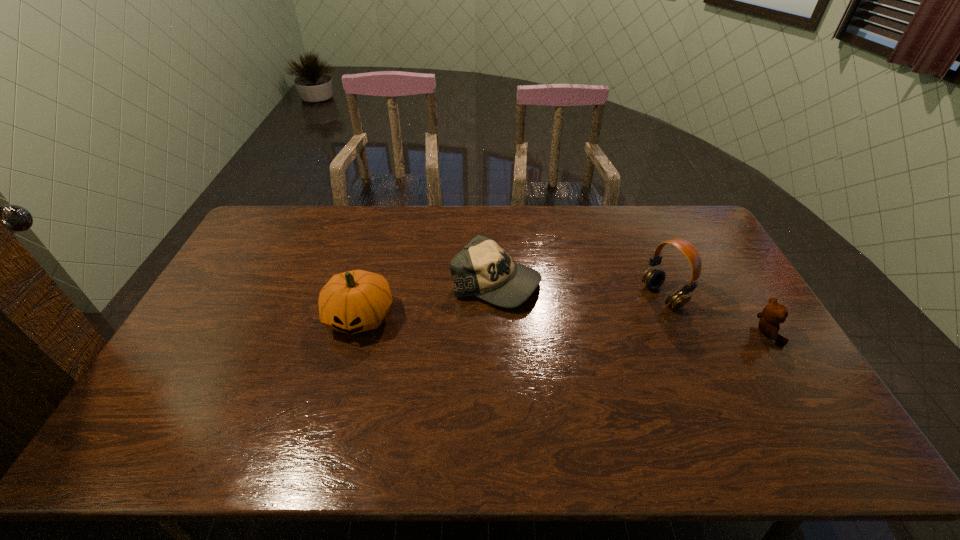
At what (x,y) coordinates should I click in order to perform the action: click on free space that satisfies the following two spatial constraints: 1. on the front side of the headset; 2. on the left side of the second object from left to right. Please return your answer as a coordinate pair (x, y). The image size is (960, 540). Looking at the image, I should click on coord(497,296).

This screenshot has width=960, height=540. In order to click on vacant area in the image that satisfies the following two spatial constraints: 1. on the side of the gourd with the carved face; 2. on the front-facing side of the rightmost object in this screenshot , I will do `click(355, 333)`.

The image size is (960, 540). Find the location of `vacant space that satisfies the following two spatial constraints: 1. on the side of the teddy bear with the carved face; 2. on the front-facing side of the second tallest object`. vacant space that satisfies the following two spatial constraints: 1. on the side of the teddy bear with the carved face; 2. on the front-facing side of the second tallest object is located at coordinates (355, 333).